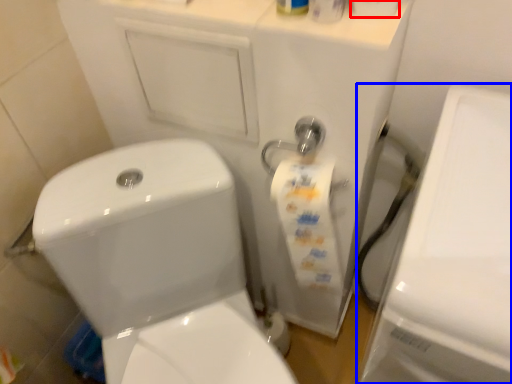
Question: Which object appears farthest to the camera in this image, toilet paper (highlighted by a red box) or porcelain (highlighted by a blue box)?

Choices:
 (A) toilet paper
 (B) porcelain

Answer: (A)